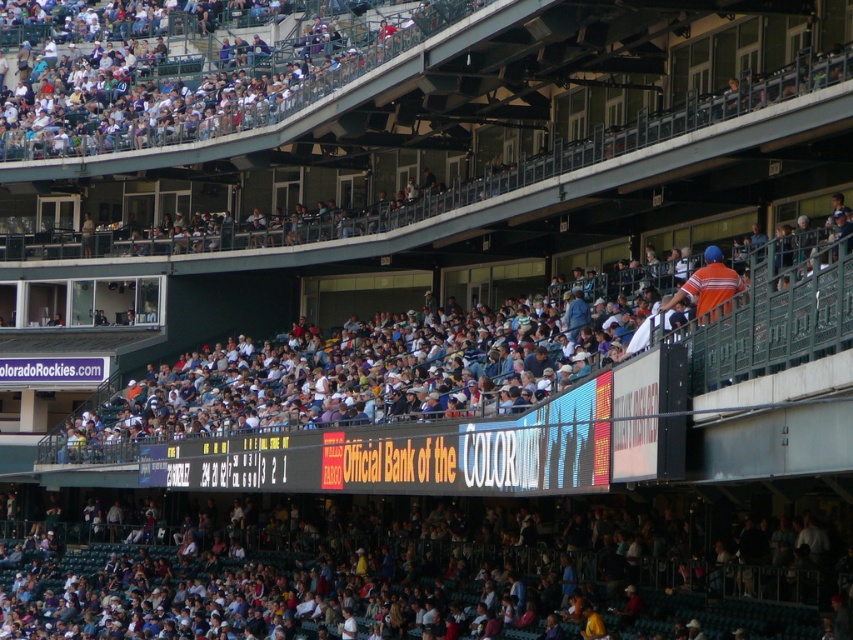
Question: Does dark blue seats at lower center appear under white plastic seats at upper center?

Choices:
 (A) yes
 (B) no

Answer: (A)

Question: Among these points, which one is farthest from the camera?

Choices:
 (A) (248, 100)
 (B) (251, 616)

Answer: (A)

Question: Which of the following is the closest to the observer?

Choices:
 (A) (370, 56)
 (B) (821, 596)

Answer: (B)

Question: Is dark blue seats at lower center further to camera compared to white plastic seats at upper center?

Choices:
 (A) no
 (B) yes

Answer: (A)

Question: Does dark blue seats at lower center appear under white plastic seats at upper center?

Choices:
 (A) yes
 (B) no

Answer: (A)

Question: Which point appears farthest from the camera in this image?

Choices:
 (A) (294, 84)
 (B) (489, 545)

Answer: (A)